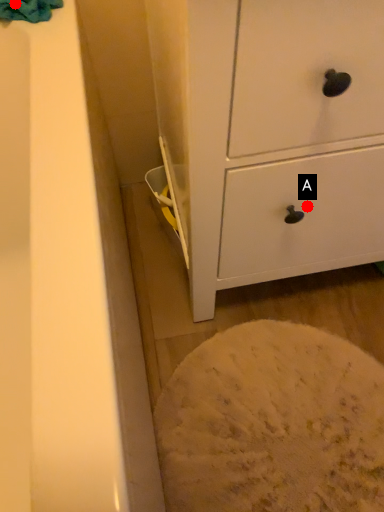
Question: Two points are circled on the image, labeled by A and B beside each circle. Which point appears closest to the camera in this image?

Choices:
 (A) A is closer
 (B) B is closer

Answer: (A)